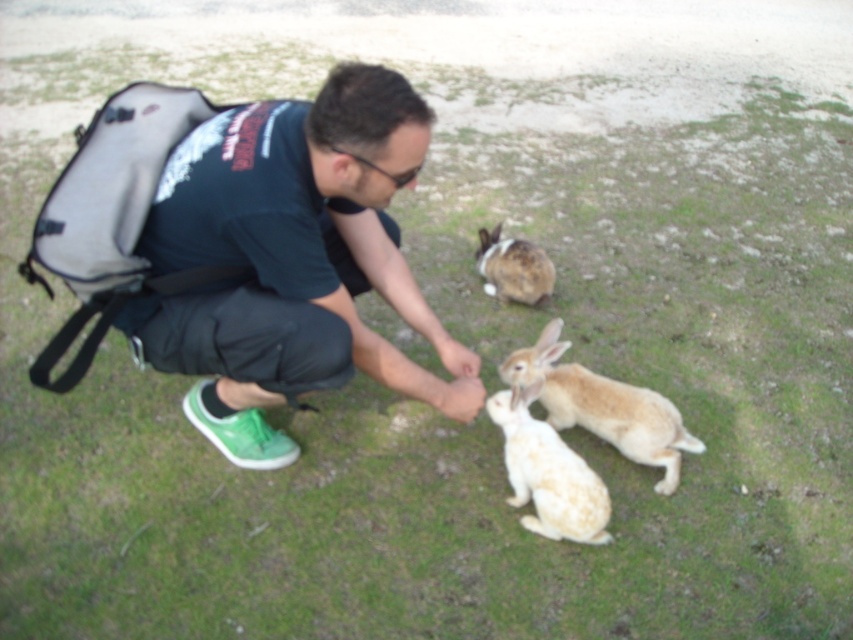
Question: Does light brown fur rabbit at center have a lesser width compared to white fluffy rabbit at lower center?

Choices:
 (A) yes
 (B) no

Answer: (B)

Question: Which object appears closest to the camera in this image?

Choices:
 (A) brown speckled fur at center
 (B) light brown fur rabbit at center
 (C) white fluffy rabbit at lower center
 (D) green fabric shirt at center

Answer: (D)

Question: Is green fabric shirt at center thinner than light brown fur rabbit at center?

Choices:
 (A) yes
 (B) no

Answer: (B)

Question: Which object is the farthest from the white fluffy rabbit at lower center?

Choices:
 (A) brown speckled fur at center
 (B) green fabric shirt at center
 (C) light brown fur rabbit at center

Answer: (A)

Question: Where is light brown fur rabbit at center located in relation to brown speckled fur at center in the image?

Choices:
 (A) left
 (B) right

Answer: (B)

Question: Which of the following is the closest to the observer?

Choices:
 (A) green fabric shirt at center
 (B) white fluffy rabbit at lower center

Answer: (A)